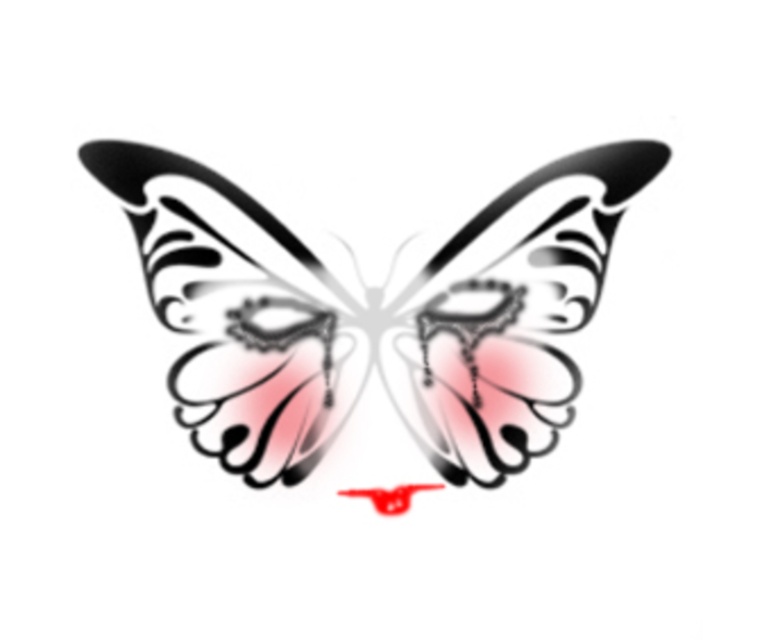
You are examining the butterfly design and want to place a tiny sticker on the point that is closer to you. Which point should you choose between the point at coordinates point (302, 385) and point (140, 180)?

Point (140, 180) is closer to the camera than point (302, 385), so you should place the sticker on point (140, 180).

You are an artist trying to frame a butterfly artwork. The frame you have is exactly the width of the translucent paper butterfly at center. Will this frame also fit the black glossy wing at center?

The translucent paper butterfly at center might be wider than black glossy wing at center, so the frame designed for the butterfly might be wide enough to accommodate the wing, but there is uncertainty due to the comparative width not being definitively stated.